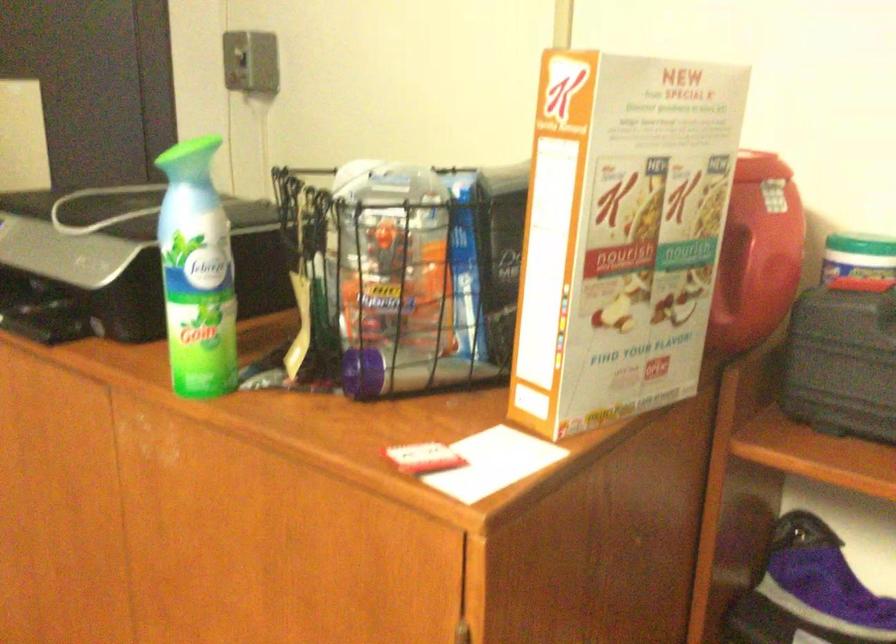
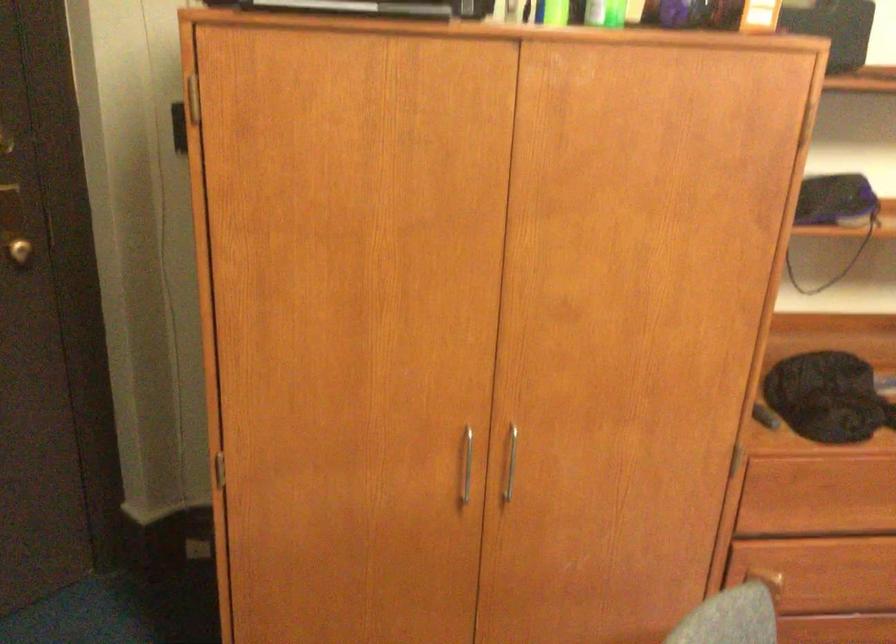
Where in the second image is the point corresponding to point 227,364 from the first image?

(556, 13)